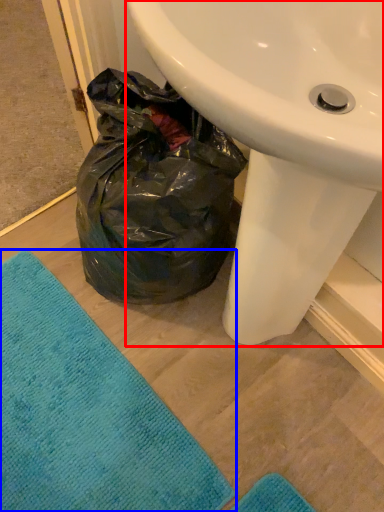
Question: Which object is further to the camera taking this photo, sink (highlighted by a red box) or beach towel (highlighted by a blue box)?

Choices:
 (A) sink
 (B) beach towel

Answer: (B)